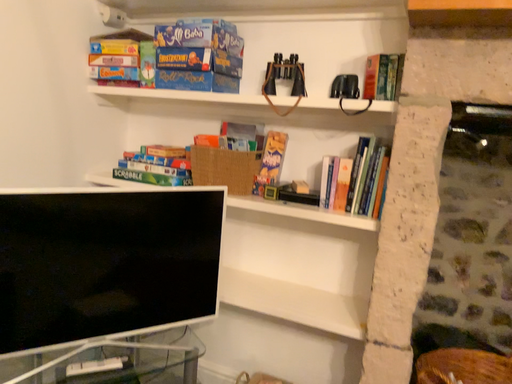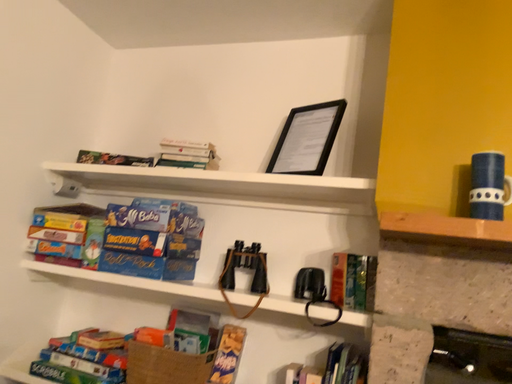
Question: How did the camera likely rotate when shooting the video?

Choices:
 (A) rotated upward
 (B) rotated downward

Answer: (A)